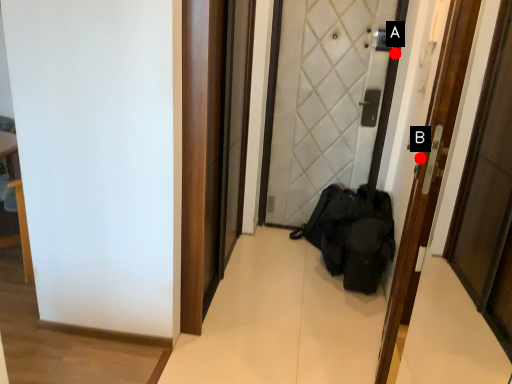
Question: Two points are circled on the image, labeled by A and B beside each circle. Among these points, which one is nearest to the camera?

Choices:
 (A) A is closer
 (B) B is closer

Answer: (B)